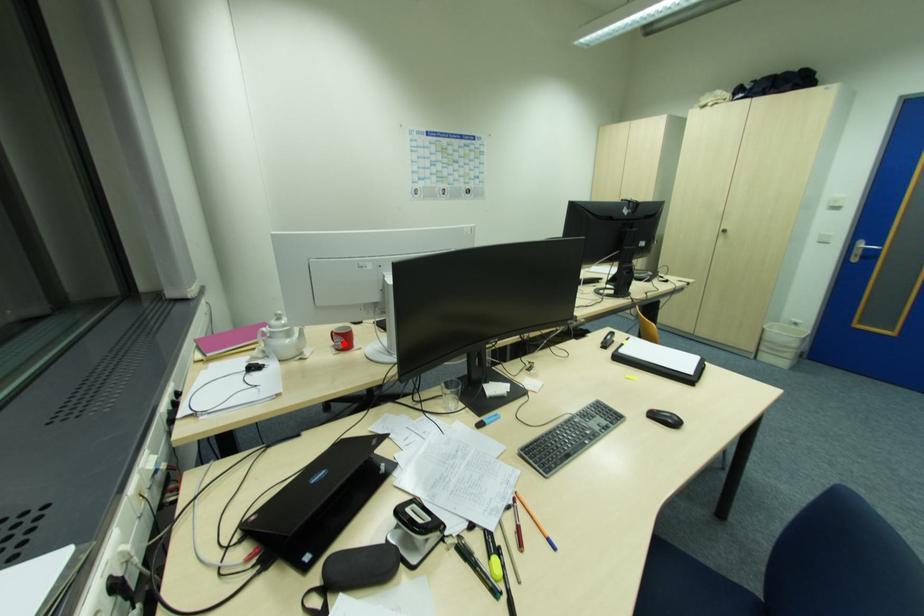
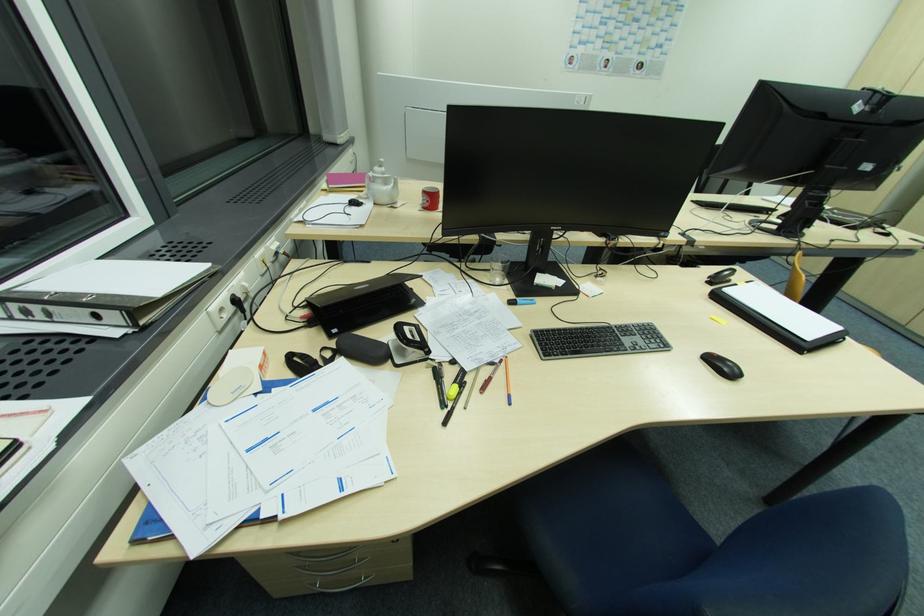
Locate, in the second image, the point that corresponds to the highlighted location in the first image.

(430, 203)